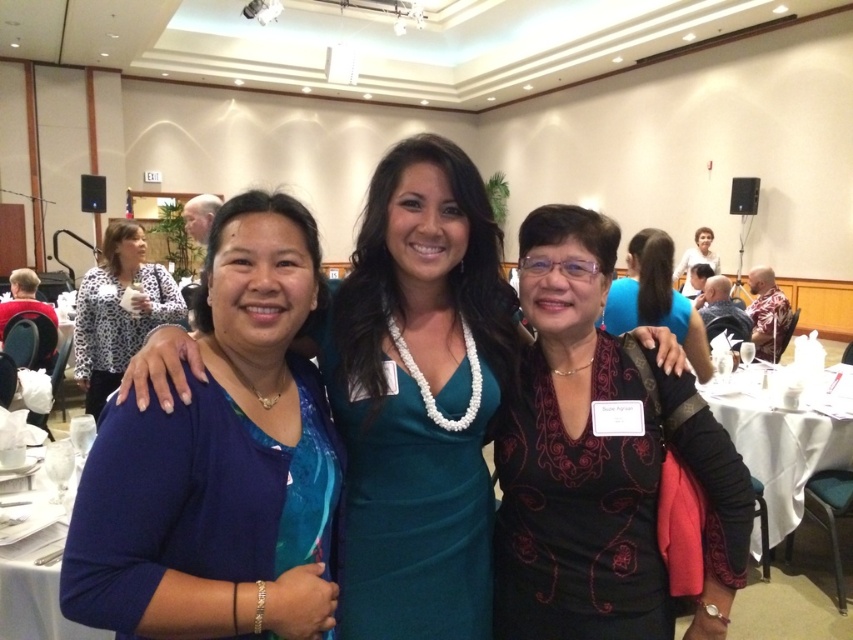
You are a photographer setting up for a group photo. You need to ensure that the black textured blouse at center and the leopard print blouse at left are visible in the frame. Given their sizes, which blouse might require you to adjust the camera angle to ensure it fits within the shot?

The leopard print blouse at left is thicker than the black textured blouse at center, so you might need to adjust the camera angle to accommodate its width.

You are a photographer at the event and want to ensure all attendees are visible in group photos. Based on the image, which clothing item at the center is taller between the black textured blouse at center and the matte black dress at center?

The black textured blouse at center is much taller than the matte black dress at center, so the black textured blouse at center will appear taller in the photo.